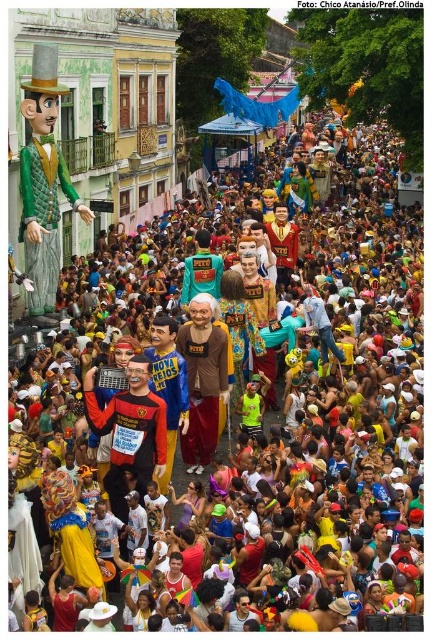
Who is shorter, green quilted fabric at left or brown matte shirt at center?

With less height is brown matte shirt at center.

Consider the image. Does green quilted fabric at left appear on the right side of brown matte shirt at center?

In fact, green quilted fabric at left is to the left of brown matte shirt at center.

In order to click on green quilted fabric at left in this screenshot , I will do `click(44, 180)`.